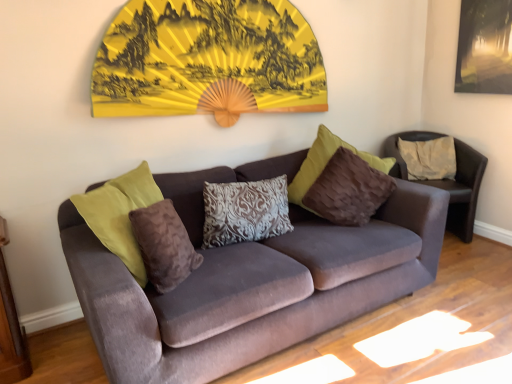
Question: Does velvet brown armchair at center have a lesser width compared to matte black picture frame at upper right?

Choices:
 (A) yes
 (B) no

Answer: (B)

Question: Can you confirm if velvet brown armchair at center is bigger than matte black picture frame at upper right?

Choices:
 (A) yes
 (B) no

Answer: (A)

Question: Is velvet brown armchair at center wider than matte black picture frame at upper right?

Choices:
 (A) no
 (B) yes

Answer: (B)

Question: Is velvet brown armchair at center outside of matte black picture frame at upper right?

Choices:
 (A) no
 (B) yes

Answer: (B)

Question: From the image's perspective, does velvet brown armchair at center appear lower than matte black picture frame at upper right?

Choices:
 (A) yes
 (B) no

Answer: (A)

Question: Considering the relative positions of velvet brown armchair at center and matte black picture frame at upper right in the image provided, is velvet brown armchair at center in front of matte black picture frame at upper right?

Choices:
 (A) no
 (B) yes

Answer: (A)

Question: Is patterned fabric pillow at center, the 2th pillow positioned from the front, far from beige fabric pillow at right, which is the first pillow from back to front?

Choices:
 (A) no
 (B) yes

Answer: (B)

Question: Considering the relative positions of patterned fabric pillow at center, positioned as the 2th pillow in right-to-left order, and beige fabric pillow at right, the third pillow in the front-to-back sequence, in the image provided, is patterned fabric pillow at center, positioned as the 2th pillow in right-to-left order, to the left of beige fabric pillow at right, the third pillow in the front-to-back sequence, from the viewer's perspective?

Choices:
 (A) yes
 (B) no

Answer: (A)

Question: Is patterned fabric pillow at center, the second pillow viewed from the left, facing away from beige fabric pillow at right, the third pillow in the front-to-back sequence?

Choices:
 (A) no
 (B) yes

Answer: (A)

Question: From a real-world perspective, does patterned fabric pillow at center, the second pillow viewed from the left, stand above beige fabric pillow at right, which is the first pillow from back to front?

Choices:
 (A) no
 (B) yes

Answer: (A)

Question: Does patterned fabric pillow at center, positioned as the 2th pillow in right-to-left order, have a larger size compared to beige fabric pillow at right, arranged as the 1th pillow when viewed from the right?

Choices:
 (A) no
 (B) yes

Answer: (B)

Question: Is beige fabric pillow at right, which is the first pillow from back to front, a part of patterned fabric pillow at center, acting as the second pillow starting from the back?

Choices:
 (A) no
 (B) yes

Answer: (A)

Question: Does brown velvety pillow at center, which appears as the 3th pillow when viewed from the back, have a greater width compared to patterned fabric pillow at center, the second pillow viewed from the left?

Choices:
 (A) yes
 (B) no

Answer: (B)